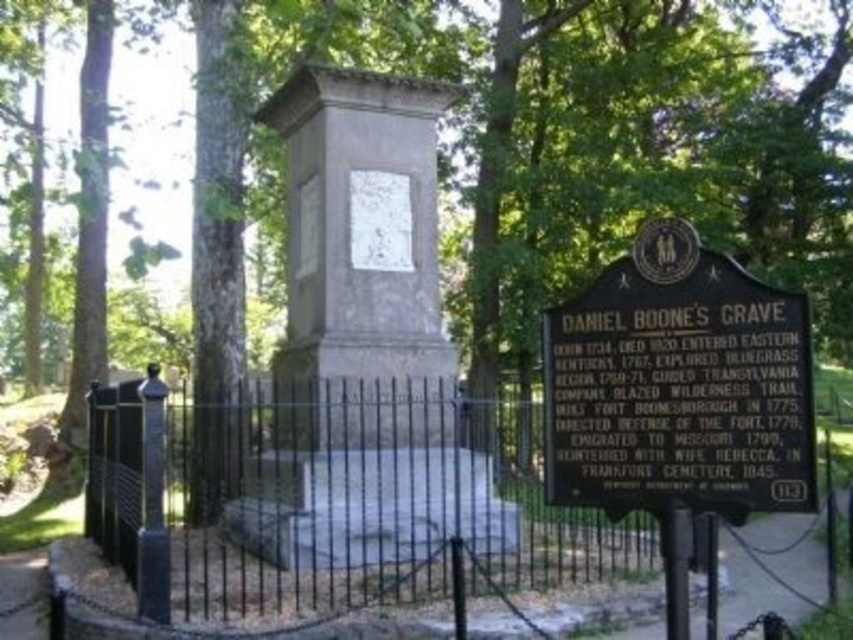
Question: Is gray stone monument at center closer to the viewer compared to black polished stone sign at center?

Choices:
 (A) no
 (B) yes

Answer: (A)

Question: Which point is closer to the camera?

Choices:
 (A) black polished stone sign at center
 (B) gray stone monument at center

Answer: (A)

Question: Which point is farther to the camera?

Choices:
 (A) pyautogui.click(x=309, y=532)
 (B) pyautogui.click(x=787, y=316)

Answer: (A)

Question: Does gray stone monument at center appear on the right side of black polished stone sign at center?

Choices:
 (A) yes
 (B) no

Answer: (B)

Question: Which of the following is the farthest from the observer?

Choices:
 (A) black polished stone sign at center
 (B) gray stone monument at center

Answer: (B)

Question: In this image, where is gray stone monument at center located relative to black polished stone sign at center?

Choices:
 (A) below
 (B) above

Answer: (B)